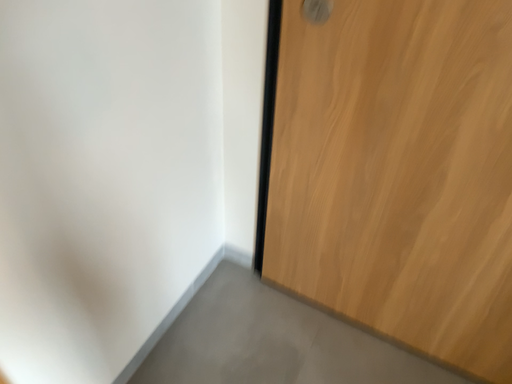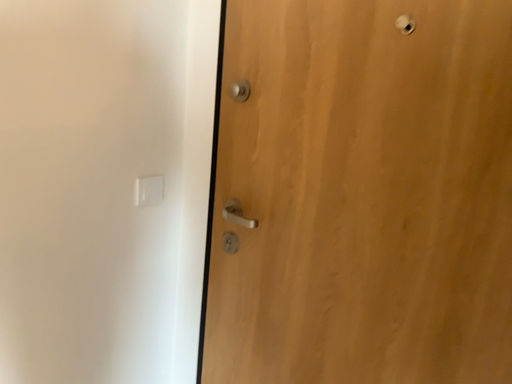
Question: How did the camera likely rotate when shooting the video?

Choices:
 (A) rotated downward
 (B) rotated upward

Answer: (B)